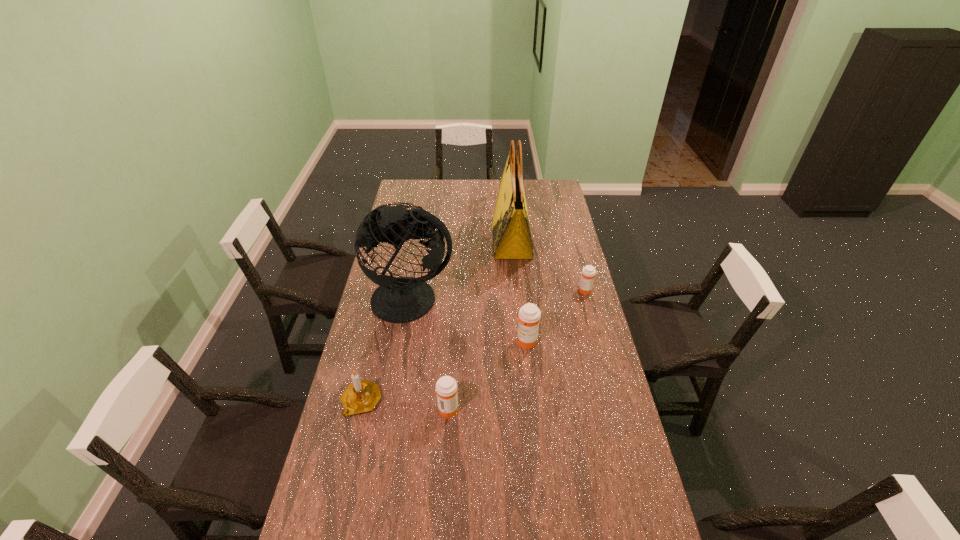
You are a GUI agent. You are given a task and a screenshot of the screen. Output one action in this format:
    pyautogui.click(x=<x>, y=<y>)
    Task: Click on the vacant area in the image that satisfies the following two spatial constraints: 1. on the front-facing side of the tote bag; 2. on the front side of the nearest medicine
    Image resolution: width=960 pixels, height=540 pixels.
    Given the screenshot: What is the action you would take?
    pyautogui.click(x=527, y=408)

At what (x,y) coordinates should I click in order to perform the action: click on free space that satisfies the following two spatial constraints: 1. on the back side of the fourth farthest object; 2. on the right side of the rightmost object. Please return your answer as a coordinate pair (x, y). Looking at the image, I should click on (520, 291).